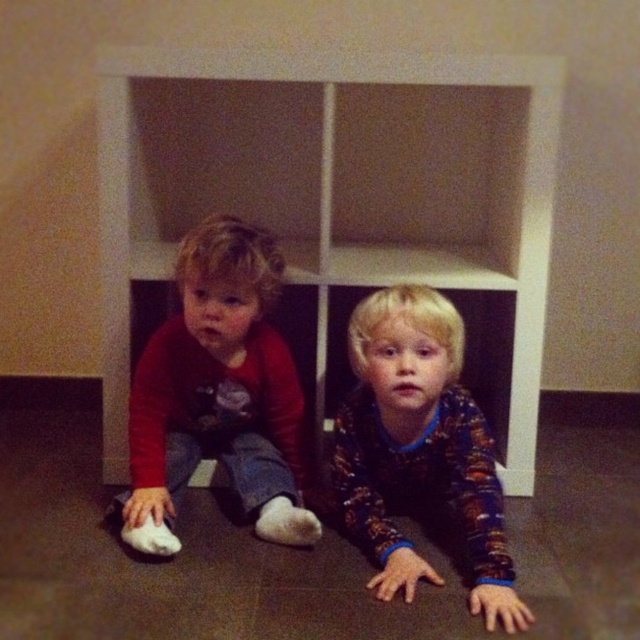
Between matte red shirt at left and flannel pajamas at lower center, which one is positioned lower?

flannel pajamas at lower center

Does matte red shirt at left come behind flannel pajamas at lower center?

Yes, it is.

Is point (214, 310) closer to camera compared to point (378, 586)?

No, it is not.

Where is `matte red shirt at left`? matte red shirt at left is located at coordinates coord(220,392).